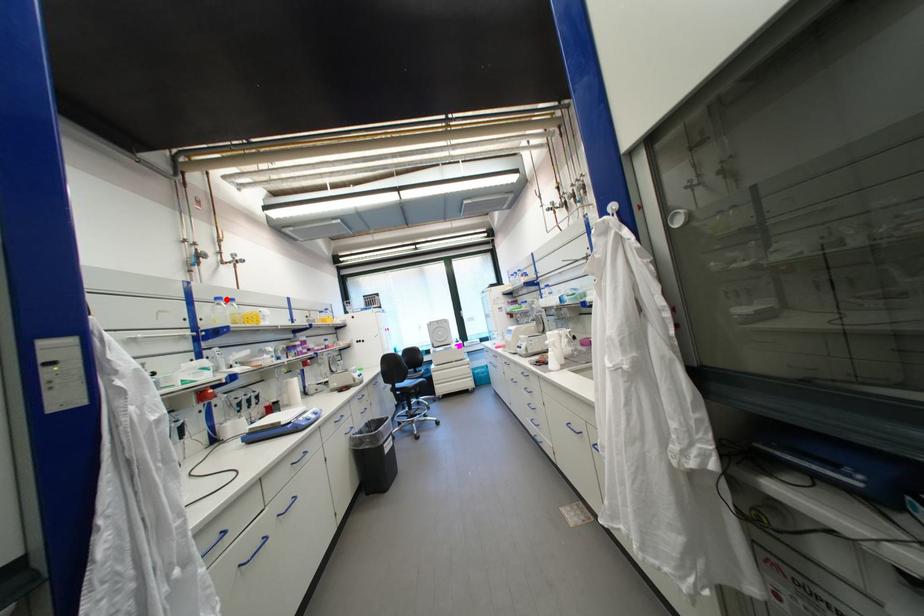
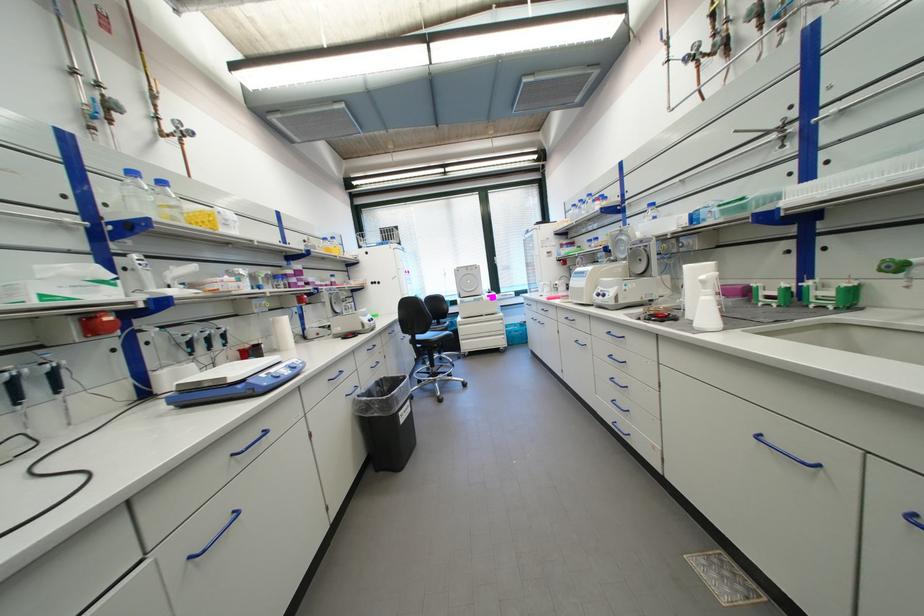
Where in the second image is the point corresponding to the highlighted location from the first image?

(140, 174)